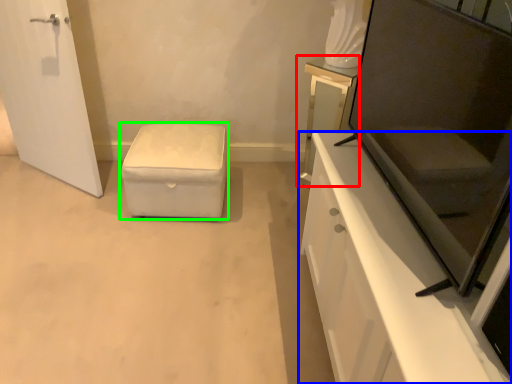
Question: Considering the real-world distances, which object is farthest from vanity (highlighted by a red box)? cabinetry (highlighted by a blue box) or furniture (highlighted by a green box)?

Choices:
 (A) cabinetry
 (B) furniture

Answer: (B)